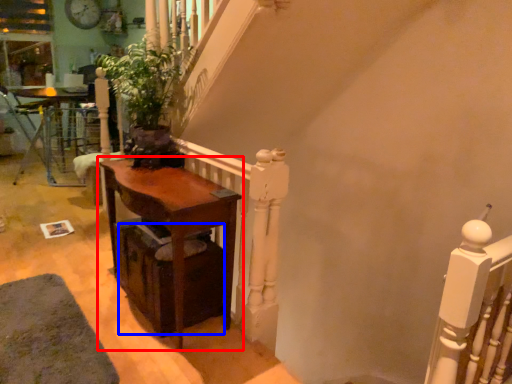
Question: Which point is closer to the camera, table (highlighted by a red box) or drawer (highlighted by a blue box)?

Choices:
 (A) table
 (B) drawer

Answer: (A)